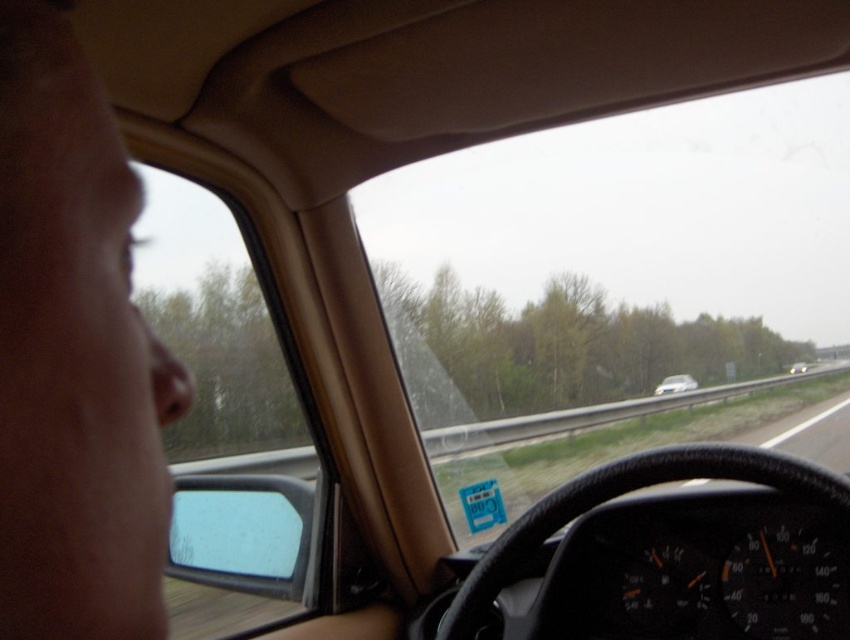
You are sitting in the passenger seat of a car and looking forward. You see the transparent glass windshield at upper center and the silver metallic sedan at center. Which object is positioned to the left?

The transparent glass windshield at upper center is positioned to the left of the silver metallic sedan at center according to the description.

You are a passenger in a car and want to check if you can see the silver metallic sedan at center through the transparent glass windshield at upper center. Can you see it?

The transparent glass windshield at upper center is wider than the silver metallic sedan at center, so yes, you can see the silver metallic sedan at center through the transparent glass windshield at upper center.

You are sitting in the passenger seat of the car and notice two points marked on the windshield. The first point is at coordinates point (372, 243) and the second is at point (795, 372). Which point is closer to your eyes?

Point (372, 243) is closer to the camera than point (795, 372), so the first point is closer to your eyes.